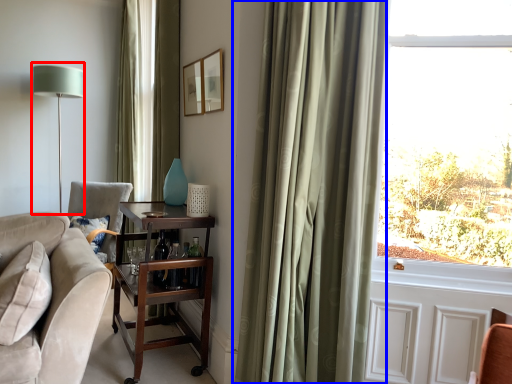
Question: Among these objects, which one is nearest to the camera, table lamp (highlighted by a red box) or curtain (highlighted by a blue box)?

Choices:
 (A) table lamp
 (B) curtain

Answer: (B)